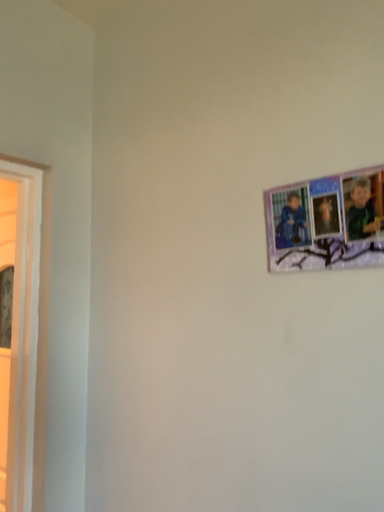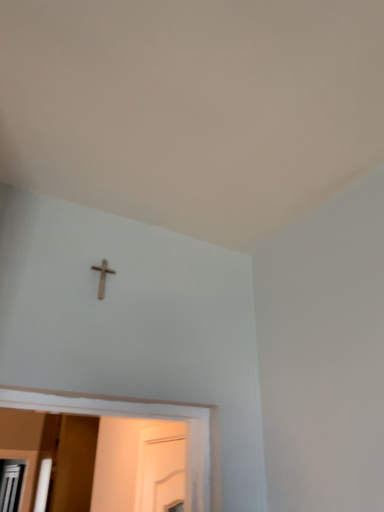
Question: Which way did the camera rotate in the video?

Choices:
 (A) rotated upward
 (B) rotated downward

Answer: (A)